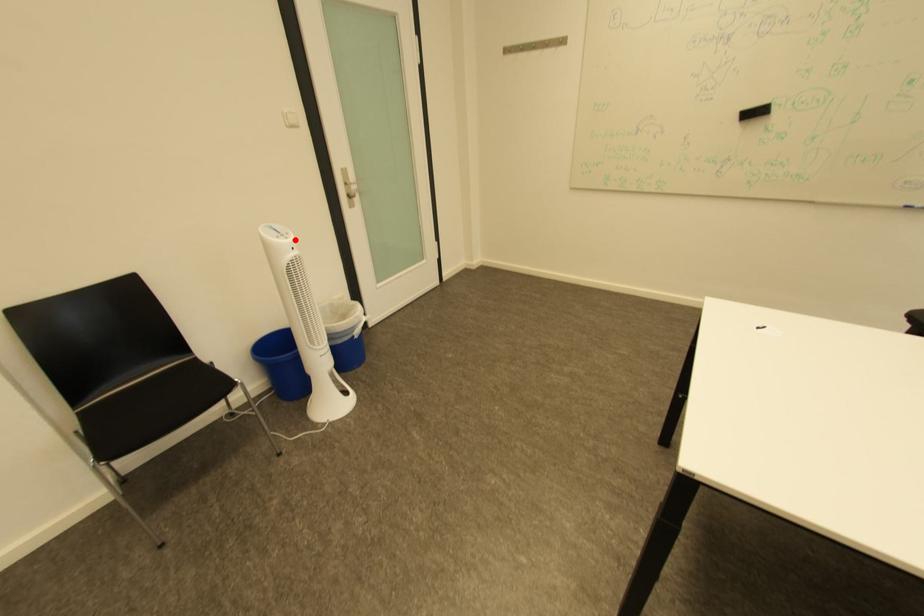
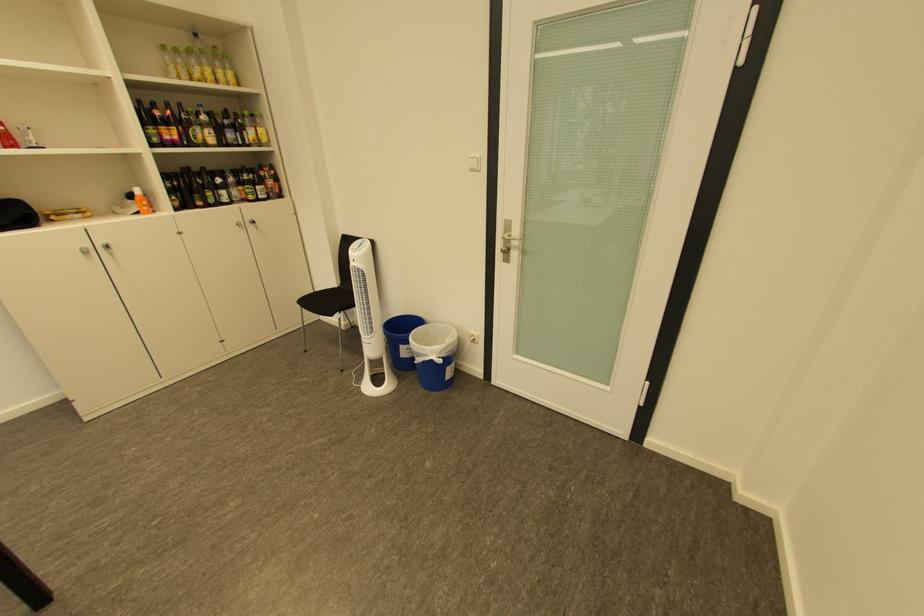
The point at the highlighted location is marked in the first image. Where is the corresponding point in the second image?

(363, 253)